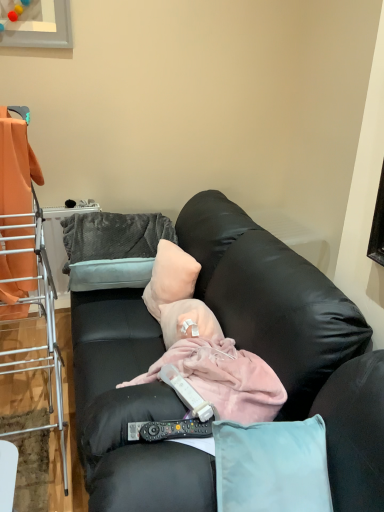
What is the approximate width of pale pink fabric pillow at center, the 1th pillow from the right?

The width of pale pink fabric pillow at center, the 1th pillow from the right, is 7.39 inches.

The height and width of the screenshot is (512, 384). What are the coordinates of `orange fabric at left` in the screenshot? It's located at tap(26, 262).

Measure the distance between point (195, 407) and camera.

1.16 meters.

The image size is (384, 512). What do you see at coordinates (112, 249) in the screenshot?
I see `gray plush pillow at upper left, which ranks as the 1th pillow in left-to-right order` at bounding box center [112, 249].

Where is `black plastic remote control at lower center, which is the first remote control from bottom to top`? Image resolution: width=384 pixels, height=512 pixels. black plastic remote control at lower center, which is the first remote control from bottom to top is located at coordinates (169, 430).

What do you see at coordinates (169, 430) in the screenshot? This screenshot has height=512, width=384. I see `black plastic remote control at lower center, positioned as the 2th remote control in top-to-bottom order` at bounding box center [169, 430].

Locate an element on the screen. pale pink fabric pillow at center, acting as the 2th pillow starting from the left is located at coordinates (x=170, y=277).

Does black plastic remote control at lower center, positioned as the 2th remote control in top-to-bottom order, come behind black leather couch at center?

Yes, the depth of black plastic remote control at lower center, positioned as the 2th remote control in top-to-bottom order, is greater than that of black leather couch at center.

Is black plastic remote control at lower center, which is the first remote control from bottom to top, to the right of black leather couch at center from the viewer's perspective?

Indeed, black plastic remote control at lower center, which is the first remote control from bottom to top, is positioned on the right side of black leather couch at center.

Is black plastic remote control at lower center, positioned as the 2th remote control in top-to-bottom order, positioned beyond the bounds of black leather couch at center?

Actually, black plastic remote control at lower center, positioned as the 2th remote control in top-to-bottom order, is at least partially inside black leather couch at center.

From a real-world perspective, who is located higher, gray plush pillow at upper left, which ranks as the 1th pillow in left-to-right order, or black leather couch at center?

From a 3D spatial view, gray plush pillow at upper left, which ranks as the 1th pillow in left-to-right order, is above.

Is gray plush pillow at upper left, which ranks as the 1th pillow in left-to-right order, spatially inside black leather couch at center, or outside of it?

gray plush pillow at upper left, which ranks as the 1th pillow in left-to-right order, is enclosed within black leather couch at center.

Image resolution: width=384 pixels, height=512 pixels. What are the coordinates of `the 2nd pillow behind the black leather couch at center` in the screenshot? It's located at point(112,249).

Considering the sizes of objects gray plush pillow at upper left, which ranks as the 1th pillow in left-to-right order, and black leather couch at center in the image provided, who is bigger, gray plush pillow at upper left, which ranks as the 1th pillow in left-to-right order, or black leather couch at center?

With larger size is black leather couch at center.

Which of these two, orange fabric at left or black leather couch at center, is thinner?

Thinner between the two is orange fabric at left.

Which is further, [1,436] or [190,456]?

Point [1,436]

Could you tell me if black plastic remote control at center, the 1th remote control from the top, is turned towards black plastic remote control at lower center, positioned as the 2th remote control in top-to-bottom order?

No, black plastic remote control at center, the 1th remote control from the top, is not aimed at black plastic remote control at lower center, positioned as the 2th remote control in top-to-bottom order.

Which object is positioned more to the right, black plastic remote control at center, the 1th remote control from the top, or black plastic remote control at lower center, which is the first remote control from bottom to top?

black plastic remote control at center, the 1th remote control from the top.

From a real-world perspective, is black plastic remote control at center, the 1th remote control from the top, below black plastic remote control at lower center, which is the first remote control from bottom to top?

Incorrect, from a real-world perspective, black plastic remote control at center, the 1th remote control from the top, is higher than black plastic remote control at lower center, which is the first remote control from bottom to top.

Is black plastic remote control at center, marked as the second remote control in a bottom-to-top arrangement, shorter than black plastic remote control at lower center, which is the first remote control from bottom to top?

Incorrect, the height of black plastic remote control at center, marked as the second remote control in a bottom-to-top arrangement, does not fall short of that of black plastic remote control at lower center, which is the first remote control from bottom to top.

From the image's perspective, between gray plush pillow at upper left, which ranks as the 1th pillow in left-to-right order, and orange fabric at left, which one is located above?

From the image's view, orange fabric at left is above.

Is orange fabric at left completely or partially inside gray plush pillow at upper left, which ranks as the 1th pillow in left-to-right order?

No, orange fabric at left is not inside gray plush pillow at upper left, which ranks as the 1th pillow in left-to-right order.

Which point is more distant from viewer, [109,215] or [10,153]?

Positioned behind is point [109,215].

Image resolution: width=384 pixels, height=512 pixels. In order to click on laundry behind the black leather couch at center in this screenshot , I will do 16,170.

Considering the relative positions of orange fabric at left and black leather couch at center in the image provided, is orange fabric at left to the left of black leather couch at center from the viewer's perspective?

Indeed, orange fabric at left is positioned on the left side of black leather couch at center.

In the scene shown: Is black leather couch at center located within orange fabric at left?

Definitely not — black leather couch at center is not inside orange fabric at left.

From a real-world perspective, is orange fabric at left on top of black leather couch at center?

Indeed, from a real-world perspective, orange fabric at left stands above black leather couch at center.

From the gray plush pillow at upper left, which ranks as the 1th pillow in left-to-right order, count 2nd remote control to the right and point to it. Please provide its 2D coordinates.

[(186, 393)]

Considering the sizes of black plastic remote control at center, marked as the second remote control in a bottom-to-top arrangement, and gray plush pillow at upper left, placed as the 2th pillow when sorted from right to left, in the image, is black plastic remote control at center, marked as the second remote control in a bottom-to-top arrangement, wider or thinner than gray plush pillow at upper left, placed as the 2th pillow when sorted from right to left,?

Considering their sizes, black plastic remote control at center, marked as the second remote control in a bottom-to-top arrangement, looks slimmer than gray plush pillow at upper left, placed as the 2th pillow when sorted from right to left.

Based on the photo, would you consider black plastic remote control at center, marked as the second remote control in a bottom-to-top arrangement, to be distant from gray plush pillow at upper left, which ranks as the 1th pillow in left-to-right order?

Actually, black plastic remote control at center, marked as the second remote control in a bottom-to-top arrangement, and gray plush pillow at upper left, which ranks as the 1th pillow in left-to-right order, are a little close together.

Locate an element on the screen. the 1st remote control positioned above the black leather couch at center (from a real-world perspective) is located at coordinates (169, 430).

From the black leather couch at center, count the 2nd pillow to the left and point to it. Please provide its 2D coordinates.

[(112, 249)]

Based on their spatial positions, is black leather couch at center or orange fabric at left closer to pale pink fabric pillow at center, acting as the 2th pillow starting from the left?

Among the two, black leather couch at center is located nearer to pale pink fabric pillow at center, acting as the 2th pillow starting from the left.

When comparing their distances from orange fabric at left, does black plastic remote control at lower center, positioned as the 2th remote control in top-to-bottom order, or gray plush pillow at upper left, placed as the 2th pillow when sorted from right to left, seem further?

Based on the image, black plastic remote control at lower center, positioned as the 2th remote control in top-to-bottom order, appears to be further to orange fabric at left.

Based on their spatial positions, is black plastic remote control at center, marked as the second remote control in a bottom-to-top arrangement, or orange fabric at left closer to black plastic remote control at lower center, which is the first remote control from bottom to top?

Among the two, black plastic remote control at center, marked as the second remote control in a bottom-to-top arrangement, is located nearer to black plastic remote control at lower center, which is the first remote control from bottom to top.

Estimate the real-world distances between objects in this image. Which object is closer to gray plush pillow at upper left, placed as the 2th pillow when sorted from right to left, orange fabric at left or black leather couch at center?

The object closer to gray plush pillow at upper left, placed as the 2th pillow when sorted from right to left, is black leather couch at center.

Looking at the image, which one is located further to orange fabric at left, orange fabric at left or black leather couch at center?

Based on the image, black leather couch at center appears to be further to orange fabric at left.

Consider the image. From the image, which object appears to be farther from black plastic remote control at center, marked as the second remote control in a bottom-to-top arrangement, orange fabric at left or black leather couch at center?

orange fabric at left lies further to black plastic remote control at center, marked as the second remote control in a bottom-to-top arrangement, than the other object.

Considering their positions, is black leather couch at center positioned closer to gray plush pillow at upper left, which ranks as the 1th pillow in left-to-right order, than orange fabric at left?

Among the two, black leather couch at center is located nearer to gray plush pillow at upper left, which ranks as the 1th pillow in left-to-right order.

In the scene shown: Based on their spatial positions, is gray plush pillow at upper left, placed as the 2th pillow when sorted from right to left, or orange fabric at left closer to black plastic remote control at lower center, positioned as the 2th remote control in top-to-bottom order?

Based on the image, orange fabric at left appears to be nearer to black plastic remote control at lower center, positioned as the 2th remote control in top-to-bottom order.

Find the location of a particular element. The width and height of the screenshot is (384, 512). pillow positioned between orange fabric at left and gray plush pillow at upper left, which ranks as the 1th pillow in left-to-right order, from near to far is located at coordinates (170, 277).

Identify the location of remote control between orange fabric at left and black plastic remote control at center, marked as the second remote control in a bottom-to-top arrangement, in the horizontal direction. The height and width of the screenshot is (512, 384). (169, 430).

Identify the location of remote control between orange fabric at left and black plastic remote control at center, the 1th remote control from the top. This screenshot has width=384, height=512. (169, 430).

This screenshot has height=512, width=384. I want to click on remote control between black plastic remote control at lower center, which is the first remote control from bottom to top, and gray plush pillow at upper left, which ranks as the 1th pillow in left-to-right order, from front to back, so click(186, 393).